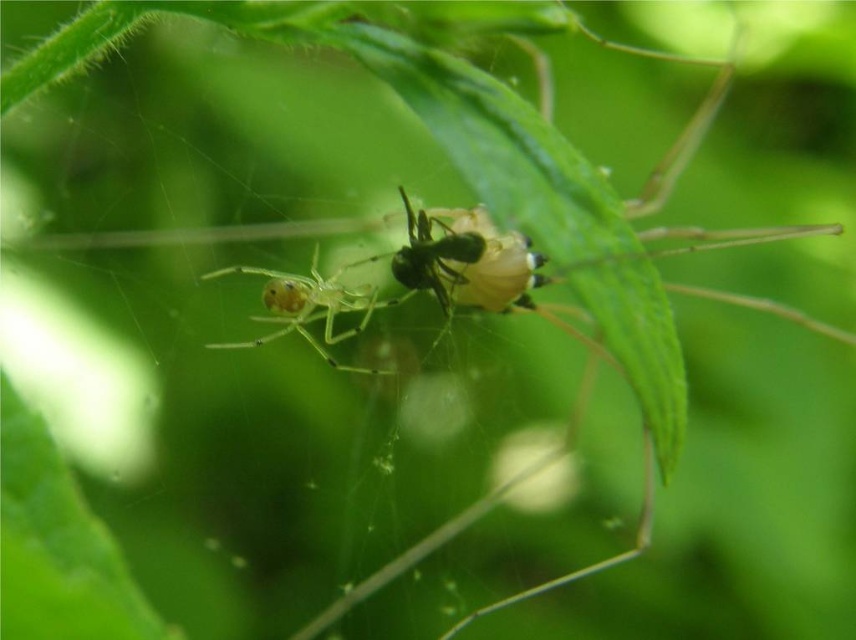
Is translucent green spider at center taller than translucent yellowish-green ant at center?

Correct, translucent green spider at center is much taller as translucent yellowish-green ant at center.

Between point (310, 294) and point (397, 250), which one is positioned in front?

Point (397, 250) is in front.

I want to click on translucent green spider at center, so click(306, 307).